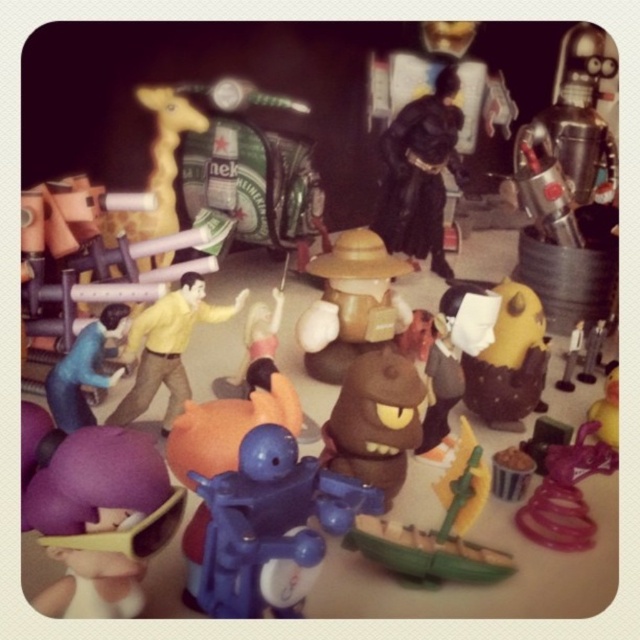
What object is located at the point with coordinates (432, 541) in the scene?

The point with coordinates (432, 541) is located on the green plastic boat at center.

You are organizing a display of toy figurines and need to place them in order from top to bottom. Given the brown matte figure at center and the blue matte figure at lower left, which one should be placed higher up?

The brown matte figure at center should be placed higher up since it is positioned above the blue matte figure at lower left in the scene.

You are organizing a toy collection and need to place the brown matte figure at center and the blue matte figure at lower left into a new display case. According to their positions in the current arrangement, which figure should be placed to the right side of the other in the new case?

The brown matte figure at center should be placed to the right side of the blue matte figure at lower left because in the current arrangement, the brown matte figure at center is positioned on the right side of the blue matte figure at lower left.